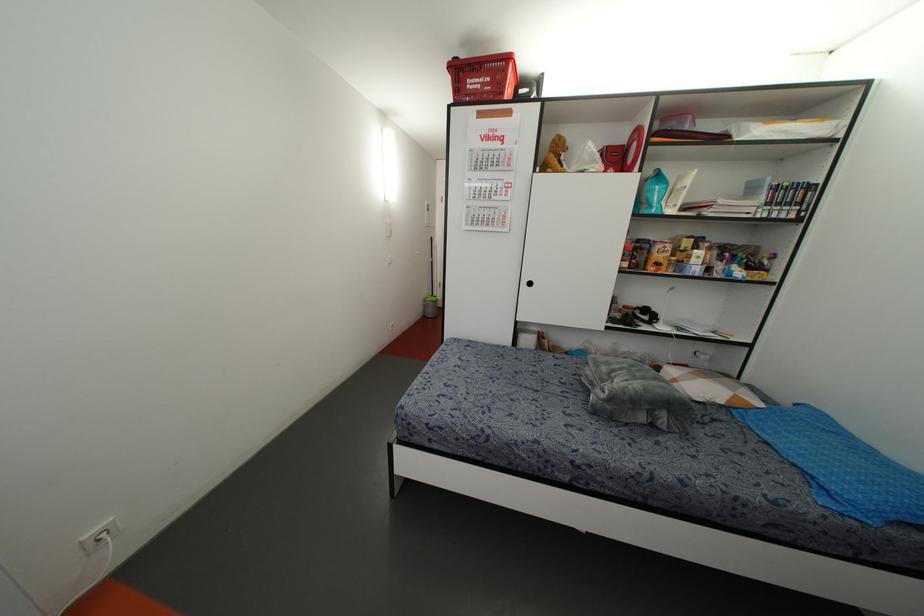
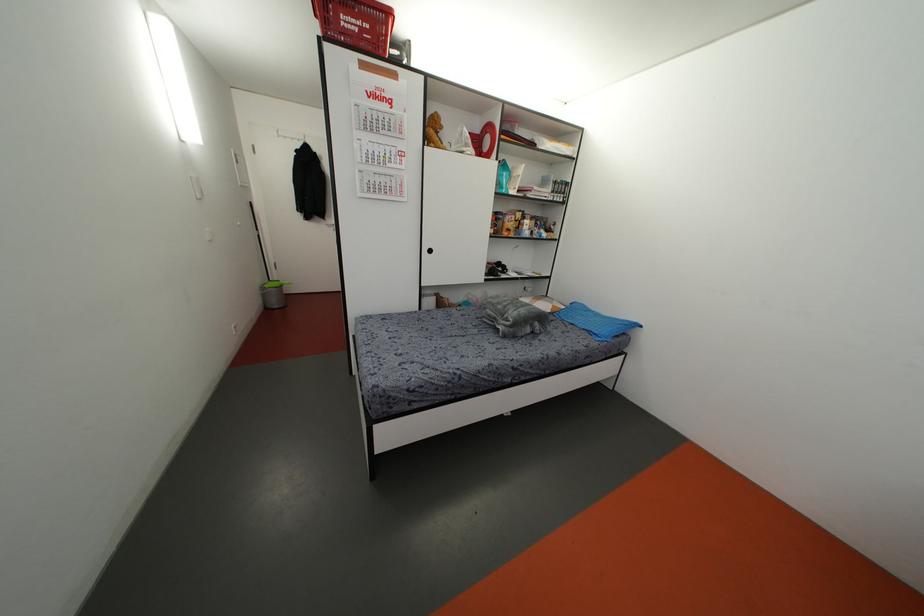
Where in the second image is the point corresponding to [423,300] from the first image?

(261, 288)